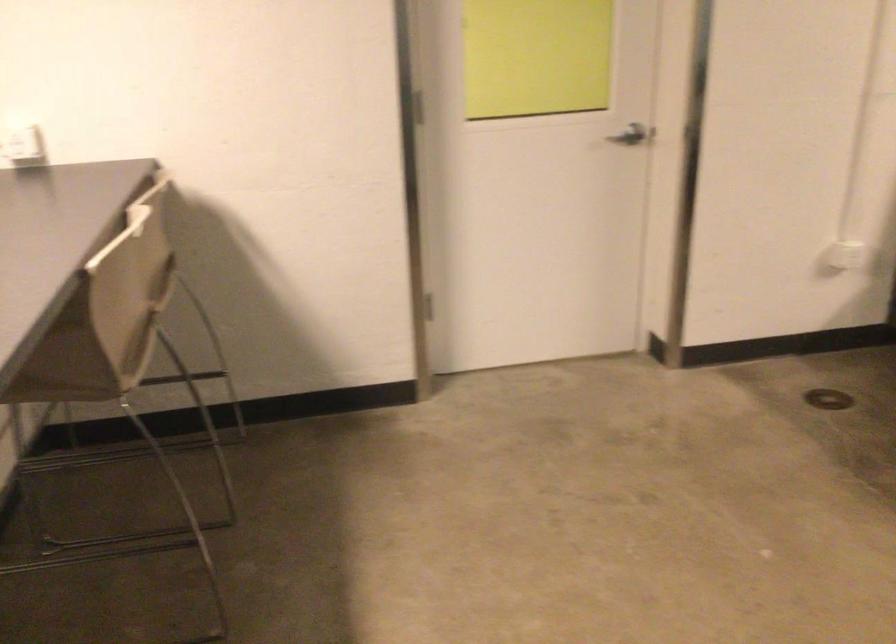
Where would you push the light switch? Please return your answer as a coordinate pair (x, y).

(22, 144)